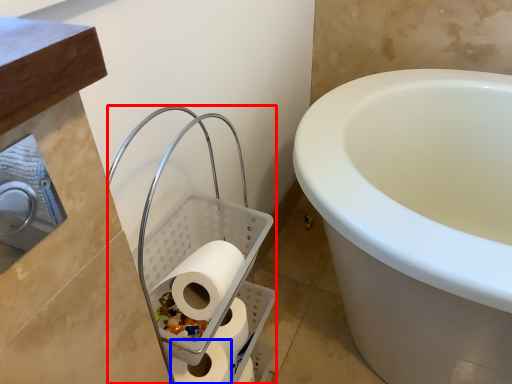
Question: Which point is further to the camera, laundry basket (highlighted by a red box) or toilet paper (highlighted by a blue box)?

Choices:
 (A) laundry basket
 (B) toilet paper

Answer: (B)